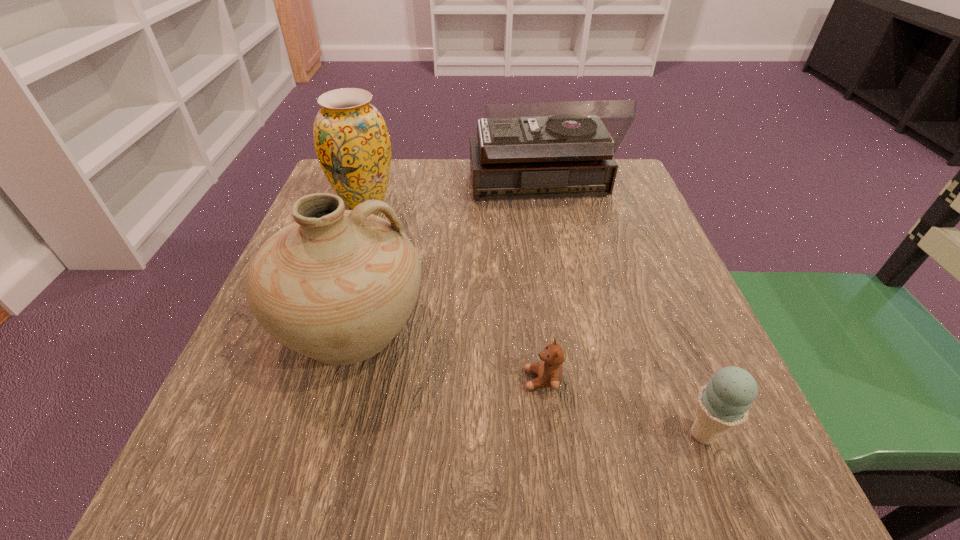
The width and height of the screenshot is (960, 540). What are the coordinates of `vacant area that lies between the second shortest object and the record player` in the screenshot? It's located at (621, 312).

I want to click on free space between the pottery and the record player, so click(445, 258).

This screenshot has height=540, width=960. Identify the location of unoccupied position between the record player and the ice cream. (621, 312).

Find the location of a particular element. The width and height of the screenshot is (960, 540). vacant region between the shortest object and the second shortest object is located at coordinates (622, 407).

Locate an element on the screen. empty location between the pottery and the teddy bear is located at coordinates (447, 353).

This screenshot has height=540, width=960. In order to click on vacant space that is in between the fourth tallest object and the vase in this screenshot , I will do `click(534, 318)`.

Where is `vacant space in between the fourth tallest object and the teddy bear`? vacant space in between the fourth tallest object and the teddy bear is located at coordinates (622, 407).

Select which object appears as the fourth closest to the fourth tallest object. Please provide its 2D coordinates. Your answer should be formatted as a tuple, i.e. [(x, y)], where the tuple contains the x and y coordinates of a point satisfying the conditions above.

[(351, 140)]

Identify which object is the fourth closest to the pottery. Please provide its 2D coordinates. Your answer should be formatted as a tuple, i.e. [(x, y)], where the tuple contains the x and y coordinates of a point satisfying the conditions above.

[(724, 403)]

Identify the location of free location that satisfies the following two spatial constraints: 1. on the front-facing side of the teddy bear; 2. on the left side of the ice cream. (549, 434).